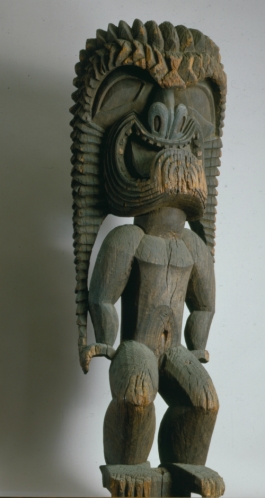
Image resolution: width=265 pixels, height=498 pixels. What are the coordinates of `pillar` in the screenshot? It's located at (166, 489).